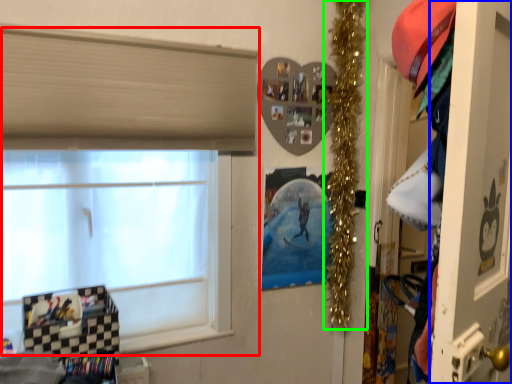
Question: Which is nearer to the window (highlighted by a red box)? screen door (highlighted by a blue box) or christmas decoration (highlighted by a green box).

Choices:
 (A) screen door
 (B) christmas decoration

Answer: (B)